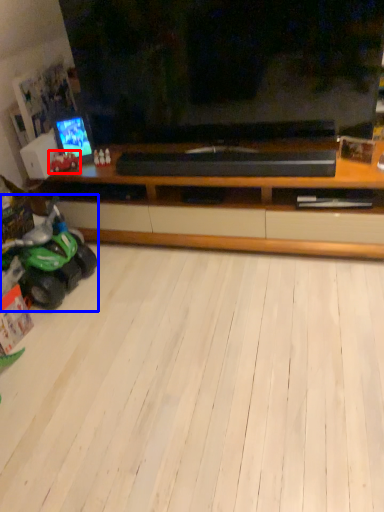
Question: Among these objects, which one is nearest to the camera, land vehicle (highlighted by a red box) or land vehicle (highlighted by a blue box)?

Choices:
 (A) land vehicle
 (B) land vehicle

Answer: (B)